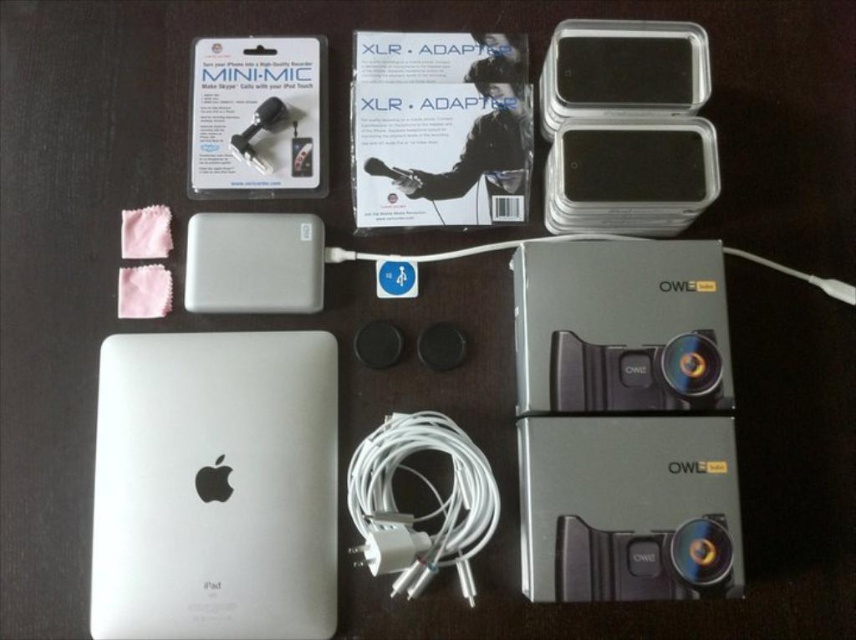
Which of these two, matte black mini-mic at upper left or black plastic ipod at upper right, stands shorter?

With less height is black plastic ipod at upper right.

Can you confirm if matte black mini-mic at upper left is smaller than black plastic ipod at upper right?

Yes.

At what (x,y) coordinates should I click in order to perform the action: click on matte black mini-mic at upper left. Please return your answer as a coordinate pair (x, y). Looking at the image, I should click on (257, 116).

Where is `matte black mini-mic at upper left`? The image size is (856, 640). matte black mini-mic at upper left is located at coordinates (257, 116).

Who is shorter, metallic gray camera at center or silver matte ipad at lower left?

With less height is silver matte ipad at lower left.

Does point (544, 429) come behind point (135, 600)?

Yes, point (544, 429) is farther from viewer.

Where is `metallic gray camera at center`? Image resolution: width=856 pixels, height=640 pixels. metallic gray camera at center is located at coordinates (623, 419).

Can you confirm if silver matte ipad at lower left is positioned above silver metallic power bank at center-left?

Incorrect, silver matte ipad at lower left is not positioned above silver metallic power bank at center-left.

Which is below, silver matte ipad at lower left or silver metallic power bank at center-left?

silver matte ipad at lower left

Is point (209, 563) in front of point (308, 225)?

Yes.

This screenshot has height=640, width=856. Find the location of `silver matte ipad at lower left`. silver matte ipad at lower left is located at coordinates (215, 486).